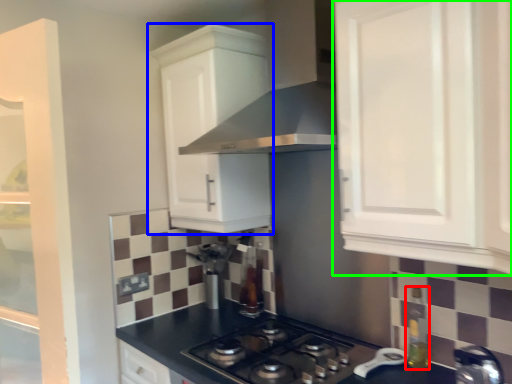
Question: Considering the real-world distances, which object is closest to bottle (highlighted by a red box)? cabinetry (highlighted by a blue box) or cabinetry (highlighted by a green box).

Choices:
 (A) cabinetry
 (B) cabinetry

Answer: (B)